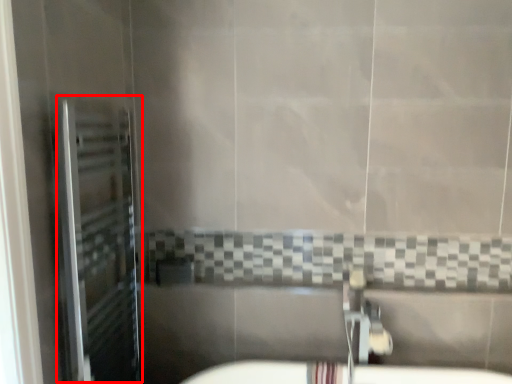
Question: From the image's perspective, what is the correct spatial relationship of screen door (annotated by the red box) in relation to plumbing fixture?

Choices:
 (A) below
 (B) above

Answer: (B)